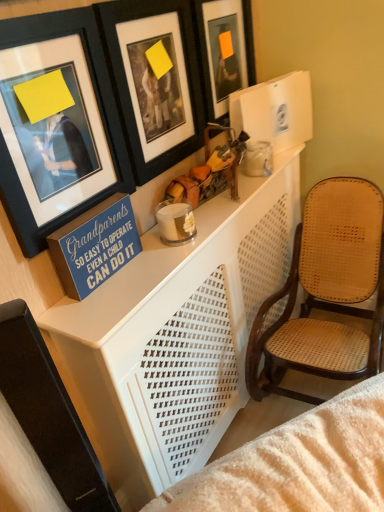
I want to click on vacant space to the right of blue painted wood sign at upper left, so pos(148,266).